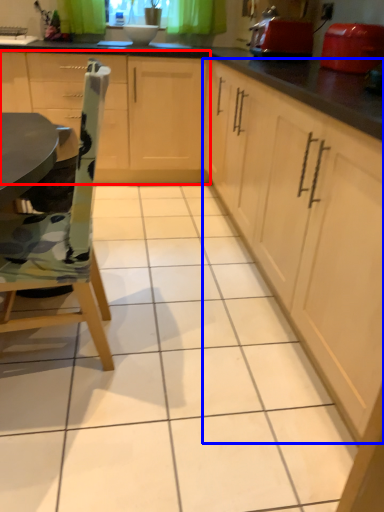
Question: Which object appears farthest to the camera in this image, cabinetry (highlighted by a red box) or cabinetry (highlighted by a blue box)?

Choices:
 (A) cabinetry
 (B) cabinetry

Answer: (A)